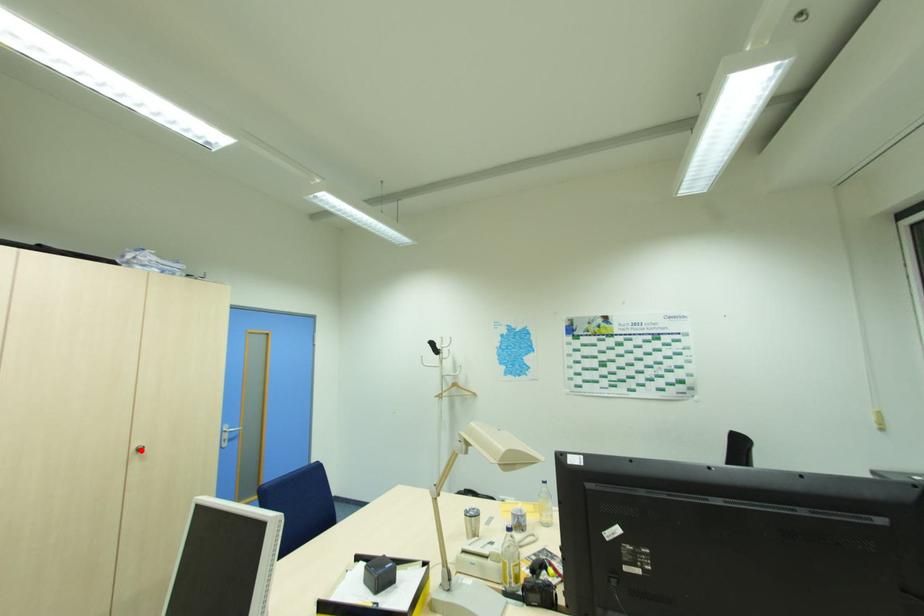
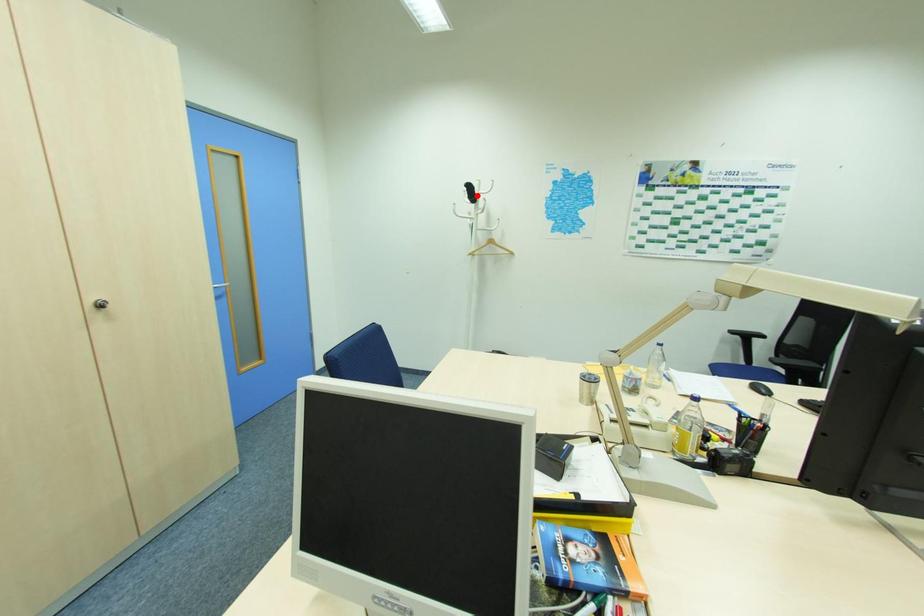
I am providing you with two images of the same scene from different viewpoints. A red point is marked on the first image and another point is marked on the second image. Is the red point in image1 aligned with the point shown in image2?

No